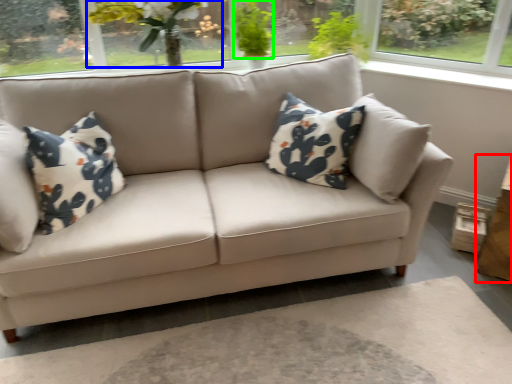
Question: Based on their relative distances, which object is nearer to table (highlighted by a red box)? Choose from floral arrangement (highlighted by a blue box) and plant (highlighted by a green box).

Choices:
 (A) floral arrangement
 (B) plant

Answer: (B)